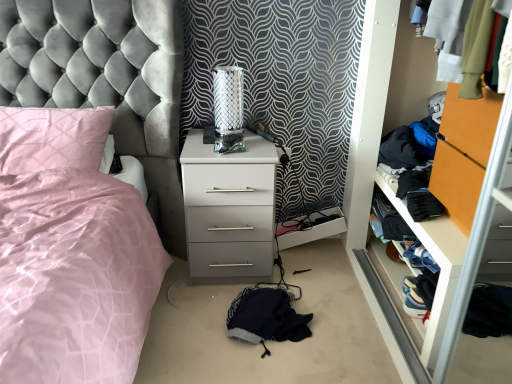
Question: Is point (229, 316) positioned closer to the camera than point (407, 225)?

Choices:
 (A) closer
 (B) farther

Answer: (A)

Question: In the image, is fuzzy dark blue blanket at lower center, the third clothing from the right, positioned in front of or behind black fleece gloves at right, which is the first clothing from top to bottom?

Choices:
 (A) behind
 (B) front

Answer: (B)

Question: Which object is positioned farthest from the satin pink bed at left?

Choices:
 (A) white glossy chest of drawers at center
 (B) denim jeans at lower right, marked as the first clothing in a right-to-left arrangement
 (C) black fleece gloves at right, the 2th clothing positioned from the left
 (D) fuzzy dark blue blanket at lower center, the first clothing when ordered from left to right
 (E) denim fabric clothes at right

Answer: (B)

Question: Which is nearer to the metallic mesh table lamp at center?

Choices:
 (A) orange wood file cabinet at right
 (B) white glossy chest of drawers at center
 (C) fuzzy dark blue blanket at lower center, the third clothing from the right
 (D) denim fabric clothes at right
 (E) pink satin pillow at left

Answer: (B)